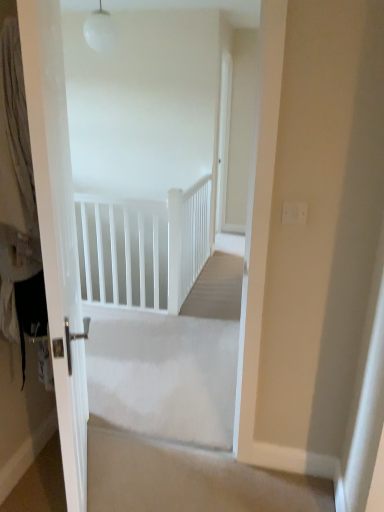
Question: Are white matte rail at upper center and white glossy door at left making contact?

Choices:
 (A) no
 (B) yes

Answer: (A)

Question: Is white matte rail at upper center positioned far away from white glossy door at left?

Choices:
 (A) yes
 (B) no

Answer: (A)

Question: Does white matte rail at upper center have a lesser width compared to white glossy door at left?

Choices:
 (A) yes
 (B) no

Answer: (B)

Question: Is white matte rail at upper center surrounding white glossy door at left?

Choices:
 (A) yes
 (B) no

Answer: (B)

Question: Considering the relative sizes of white matte rail at upper center and white glossy door at left in the image provided, is white matte rail at upper center taller than white glossy door at left?

Choices:
 (A) no
 (B) yes

Answer: (A)

Question: From a real-world perspective, is white matte rail at upper center below white glossy door at left?

Choices:
 (A) no
 (B) yes

Answer: (B)

Question: From a real-world perspective, is white matte rail at upper center over white fabric curtain at left?

Choices:
 (A) no
 (B) yes

Answer: (A)

Question: Can you confirm if white matte rail at upper center is positioned to the right of white fabric curtain at left?

Choices:
 (A) no
 (B) yes

Answer: (B)

Question: Considering the relative sizes of white matte rail at upper center and white fabric curtain at left in the image provided, is white matte rail at upper center smaller than white fabric curtain at left?

Choices:
 (A) no
 (B) yes

Answer: (A)

Question: Can you confirm if white matte rail at upper center is taller than white fabric curtain at left?

Choices:
 (A) yes
 (B) no

Answer: (B)

Question: Is white matte rail at upper center positioned beyond the bounds of white fabric curtain at left?

Choices:
 (A) yes
 (B) no

Answer: (A)

Question: Could you tell me if white matte rail at upper center is facing white fabric curtain at left?

Choices:
 (A) yes
 (B) no

Answer: (A)

Question: Considering the relative sizes of white glossy door at left and white fabric curtain at left in the image provided, is white glossy door at left thinner than white fabric curtain at left?

Choices:
 (A) no
 (B) yes

Answer: (B)